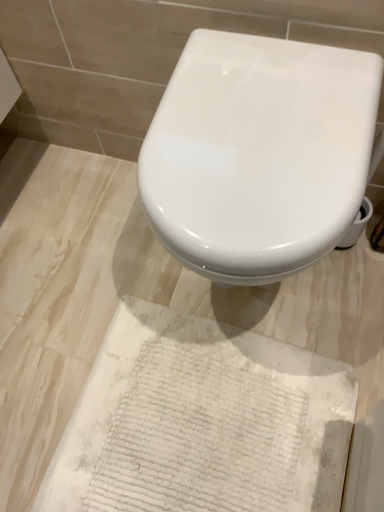
Describe the element at coordinates (202, 422) in the screenshot. The height and width of the screenshot is (512, 384). I see `white textured rug at lower center` at that location.

You are a GUI agent. You are given a task and a screenshot of the screen. Output one action in this format:
    pyautogui.click(x=<x>, y=<y>)
    Task: Click on the white textured rug at lower center
    This screenshot has width=384, height=512.
    Given the screenshot: What is the action you would take?
    [x=202, y=422]

This screenshot has width=384, height=512. What do you see at coordinates (260, 153) in the screenshot?
I see `white glossy toilet at center` at bounding box center [260, 153].

What is the approximate width of white glossy toilet at center?

white glossy toilet at center is 19.18 inches in width.

Identify the location of white glossy toilet at center. The image size is (384, 512). (260, 153).

Locate an element on the screen. white textured rug at lower center is located at coordinates (202, 422).

Does white textured rug at lower center appear on the right side of white glossy toilet at center?

No, white textured rug at lower center is not to the right of white glossy toilet at center.

Does white textured rug at lower center lie in front of white glossy toilet at center?

That is False.

Considering the points (222, 390) and (217, 111), which point is in front, point (222, 390) or point (217, 111)?

The point (217, 111) is closer.

From the image's perspective, which is above, white textured rug at lower center or white glossy toilet at center?

white glossy toilet at center, from the image's perspective.

From a real-world perspective, is white textured rug at lower center positioned above or below white glossy toilet at center?

Clearly, from a real-world perspective, white textured rug at lower center is below white glossy toilet at center.

Considering the relative sizes of white textured rug at lower center and white glossy toilet at center in the image provided, is white textured rug at lower center wider than white glossy toilet at center?

Correct, the width of white textured rug at lower center exceeds that of white glossy toilet at center.

Can you confirm if white textured rug at lower center is shorter than white glossy toilet at center?

Indeed, white textured rug at lower center has a lesser height compared to white glossy toilet at center.

Between white textured rug at lower center and white glossy toilet at center, which one has smaller size?

white textured rug at lower center.

Looking at this image, does white textured rug at lower center contain white glossy toilet at center?

No, white glossy toilet at center is not inside white textured rug at lower center.

Is white textured rug at lower center with white glossy toilet at center?

No, white textured rug at lower center is not next to white glossy toilet at center.

Is white textured rug at lower center oriented away from white glossy toilet at center?

white textured rug at lower center is not turned away from white glossy toilet at center.

Looking at this image, how different are the orientations of white textured rug at lower center and white glossy toilet at center in degrees?

91 degrees.

At what (x,y) coordinates should I click in order to perform the action: click on parchment behind the white glossy toilet at center. Please return your answer as a coordinate pair (x, y). The height and width of the screenshot is (512, 384). Looking at the image, I should click on (202, 422).

Considering the positions of objects white glossy toilet at center and white textured rug at lower center in the image provided, who is more to the left, white glossy toilet at center or white textured rug at lower center?

white textured rug at lower center is more to the left.

Is white glossy toilet at center further to camera compared to white textured rug at lower center?

No, it is not.

Considering the positions of point (267, 273) and point (215, 385), is point (267, 273) closer or farther from the camera than point (215, 385)?

Point (267, 273) appears to be closer to the viewer than point (215, 385).

From the image's perspective, which is below, white glossy toilet at center or white textured rug at lower center?

white textured rug at lower center is shown below in the image.

From a real-world perspective, which is physically above, white glossy toilet at center or white textured rug at lower center?

white glossy toilet at center, from a real-world perspective.

From the picture: Which object is wider, white glossy toilet at center or white textured rug at lower center?

With larger width is white textured rug at lower center.

In terms of height, does white glossy toilet at center look taller or shorter compared to white textured rug at lower center?

white glossy toilet at center is taller than white textured rug at lower center.

Which of these two, white glossy toilet at center or white textured rug at lower center, is smaller?

white textured rug at lower center.

Is white textured rug at lower center inside white glossy toilet at center?

That's incorrect, white textured rug at lower center is not inside white glossy toilet at center.

Is white glossy toilet at center far away from white textured rug at lower center?

No, white glossy toilet at center is in close proximity to white textured rug at lower center.

Could you tell me if white glossy toilet at center is turned towards white textured rug at lower center?

No, white glossy toilet at center is not oriented towards white textured rug at lower center.

What's the angular difference between white glossy toilet at center and white textured rug at lower center's facing directions?

white glossy toilet at center and white textured rug at lower center are facing 91 degrees away from each other.

How distant is white glossy toilet at center from white textured rug at lower center?

white glossy toilet at center and white textured rug at lower center are 49.98 centimeters apart from each other.

The width and height of the screenshot is (384, 512). In order to click on parchment below the white glossy toilet at center (from a real-world perspective) in this screenshot , I will do `click(202, 422)`.

Identify the location of parchment below the white glossy toilet at center (from the image's perspective). This screenshot has height=512, width=384. (202, 422).

Where is `toilet in front of the white textured rug at lower center`? The width and height of the screenshot is (384, 512). toilet in front of the white textured rug at lower center is located at coordinates point(260,153).